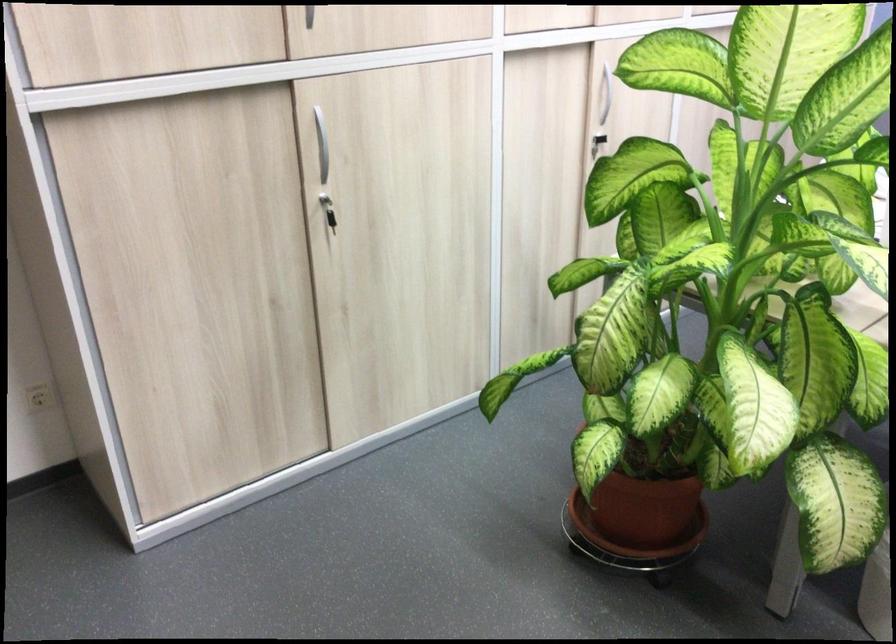
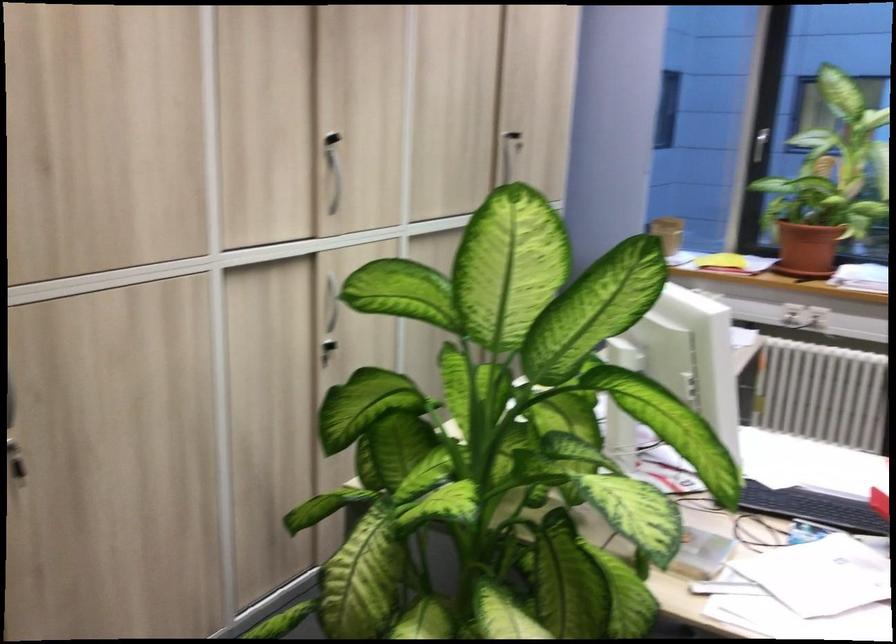
Question: How did the camera likely rotate?

Choices:
 (A) Left
 (B) Right
 (C) Up
 (D) Down

Answer: (B)